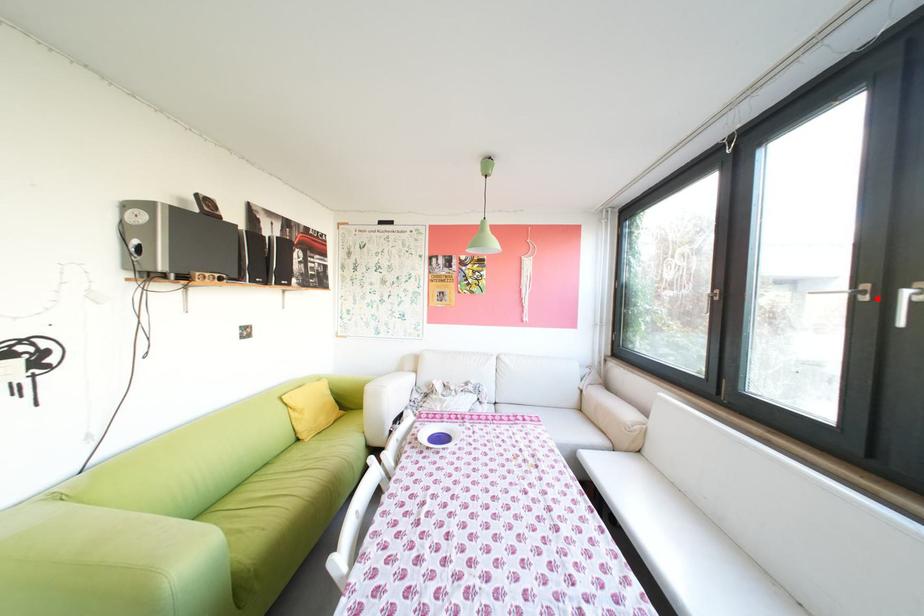
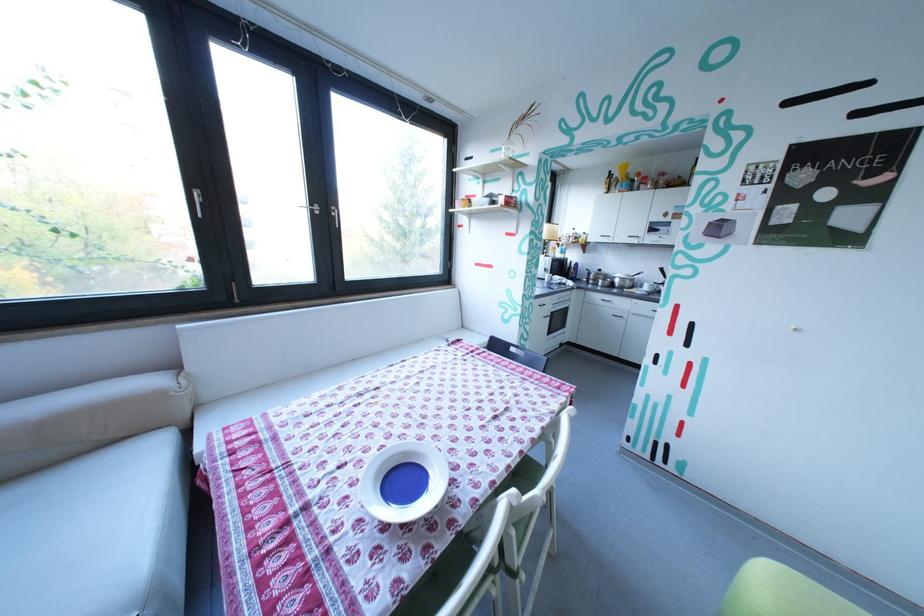
Where in the second image is the point corresponding to the highlighted location from the first image?

(331, 213)